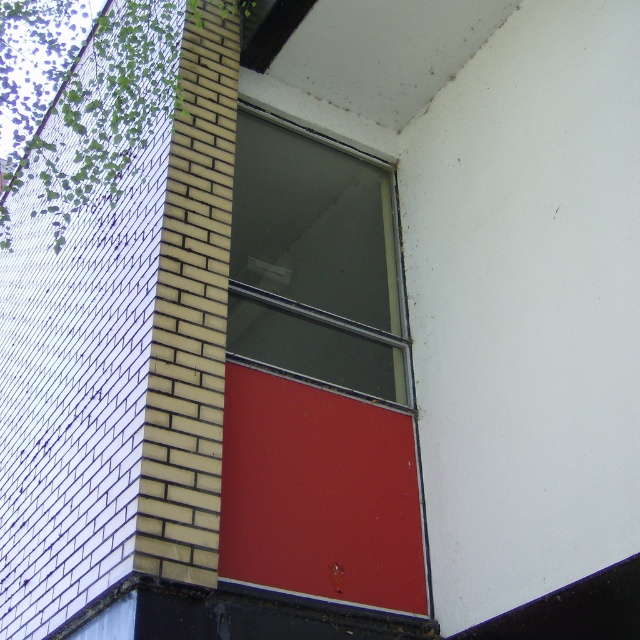
Which is below, matte red door at center or transparent glass window at center?

Positioned lower is matte red door at center.

Is the position of matte red door at center less distant than that of transparent glass window at center?

Yes, it is.

Describe the element at coordinates (317, 493) in the screenshot. The width and height of the screenshot is (640, 640). I see `matte red door at center` at that location.

You are a GUI agent. You are given a task and a screenshot of the screen. Output one action in this format:
    pyautogui.click(x=<x>, y=<y>)
    Task: Click on the matte red door at center
    The image size is (640, 640).
    Given the screenshot: What is the action you would take?
    pyautogui.click(x=317, y=493)